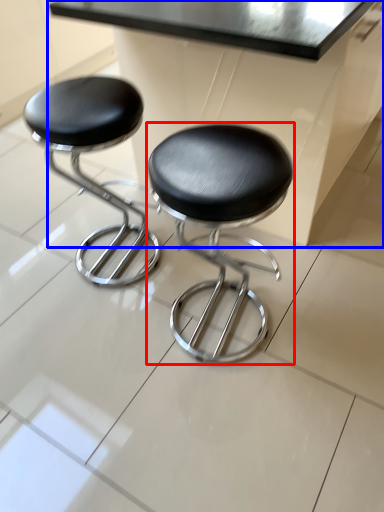
Question: Among these objects, which one is nearest to the camera, stool (highlighted by a red box) or table (highlighted by a blue box)?

Choices:
 (A) stool
 (B) table

Answer: (A)